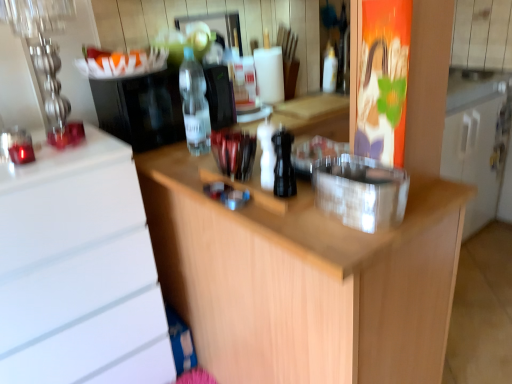
Identify the location of free point to the left of transparent plastic container at center, which is counted as the 1th appliance, starting from the front. (291, 210).